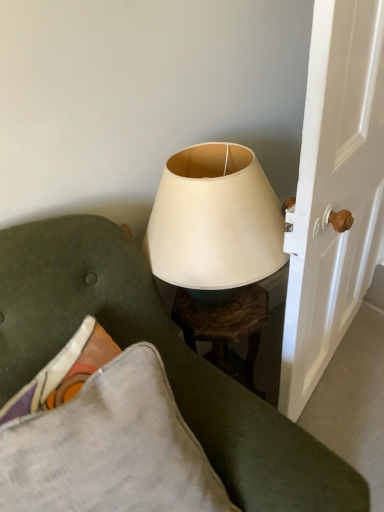
Question: In terms of size, does white glossy door handle at right appear bigger or smaller than matte white lampshade at upper center?

Choices:
 (A) big
 (B) small

Answer: (A)

Question: Is white glossy door handle at right in front of or behind matte white lampshade at upper center in the image?

Choices:
 (A) front
 (B) behind

Answer: (B)

Question: Which is nearer to the matte white lampshade at upper center?

Choices:
 (A) white glossy door handle at right
 (B) textured gray pillow at lower left
 (C) matte white lampshade at center

Answer: (B)

Question: Which object is positioned closest to the white glossy door handle at right?

Choices:
 (A) textured gray pillow at lower left
 (B) matte white lampshade at upper center
 (C) matte white lampshade at center

Answer: (C)